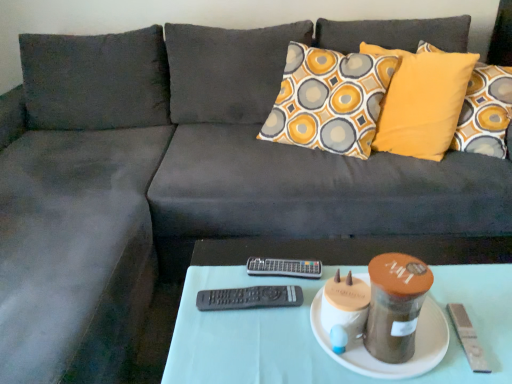
Locate an element on the screen. This screenshot has width=512, height=384. blank area to the left of black plastic remote at center, marked as the second remote in a bottom-to-top arrangement is located at coordinates (222, 273).